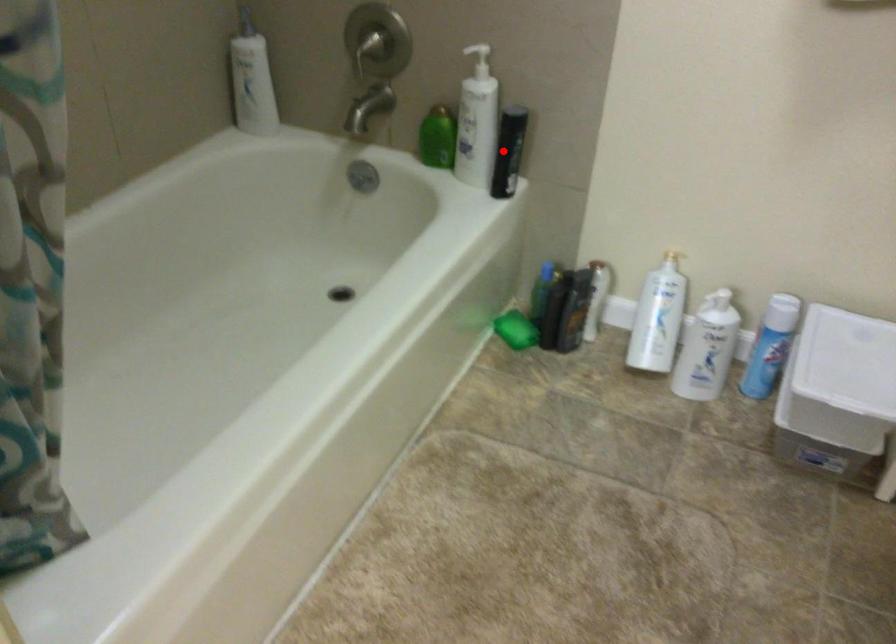
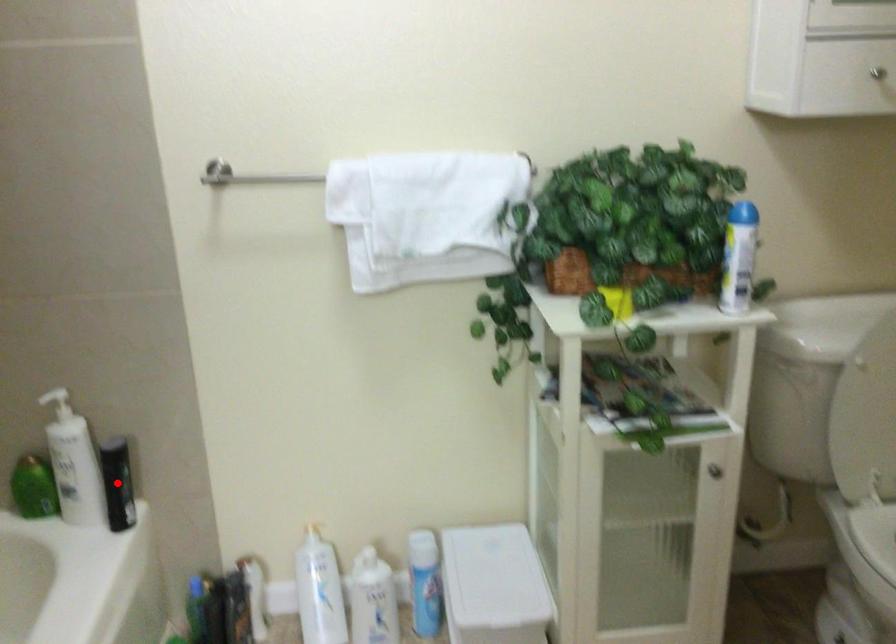
I am providing you with two images of the same scene from different viewpoints. A red point is marked on the first image and another point is marked on the second image. Is the marked point in image1 the same physical position as the marked point in image2?

Yes